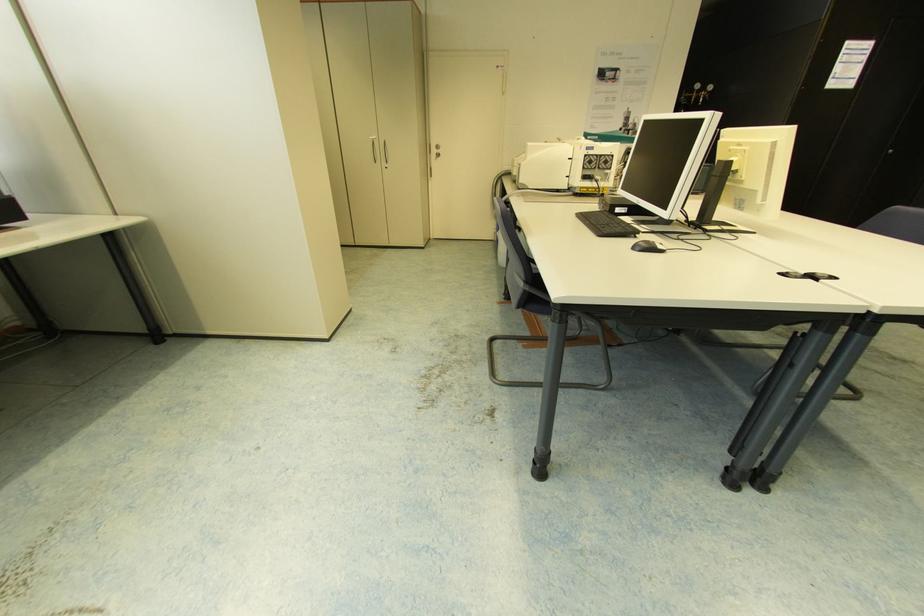
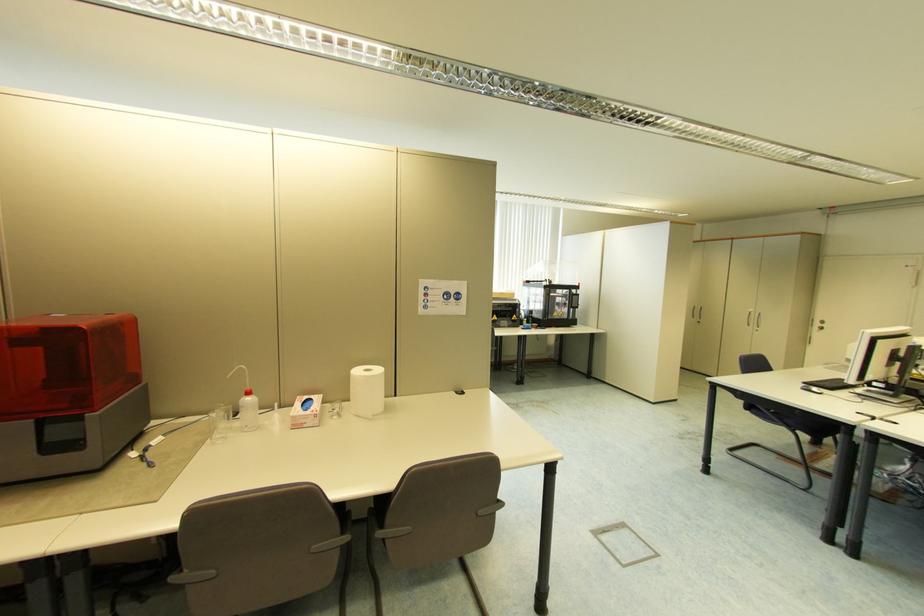
Locate, in the second image, the point that corresponds to [438,151] in the first image.

(821, 325)